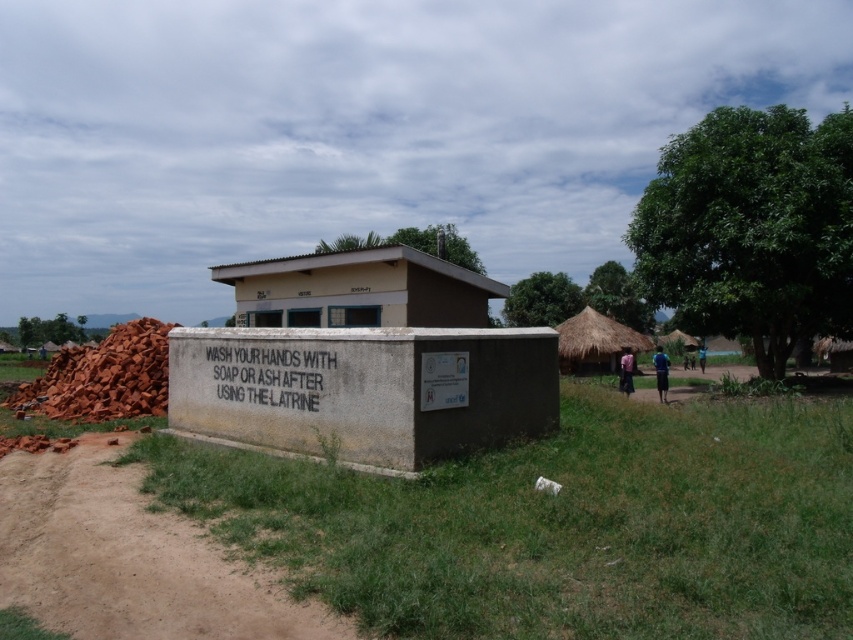
Which is in front, point (630, 349) or point (703, 346)?

Point (630, 349)

Between pink fabric dress at lower right and dark blue fabric at center, which one has more height?

pink fabric dress at lower right

Describe the element at coordinates (625, 371) in the screenshot. I see `pink fabric dress at lower right` at that location.

Find the location of `pink fabric dress at lower right`. pink fabric dress at lower right is located at coordinates (625, 371).

Does brown dirt field at lower left have a greater width compared to concrete wall at center?

Yes.

I want to click on brown dirt field at lower left, so click(x=561, y=524).

Is point (585, 365) closer to camera compared to point (701, 349)?

Yes, point (585, 365) is closer to viewer.

Can you confirm if thatched straw hut at center is bigger than dark blue fabric at center?

Indeed, thatched straw hut at center has a larger size compared to dark blue fabric at center.

Does point (608, 316) lie in front of point (697, 355)?

Yes.

The height and width of the screenshot is (640, 853). I want to click on thatched straw hut at center, so click(595, 342).